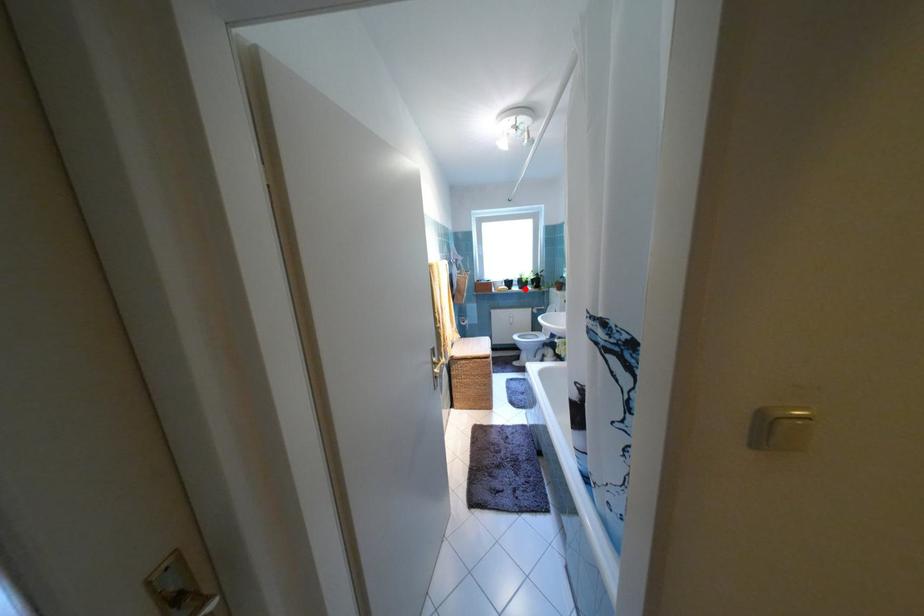
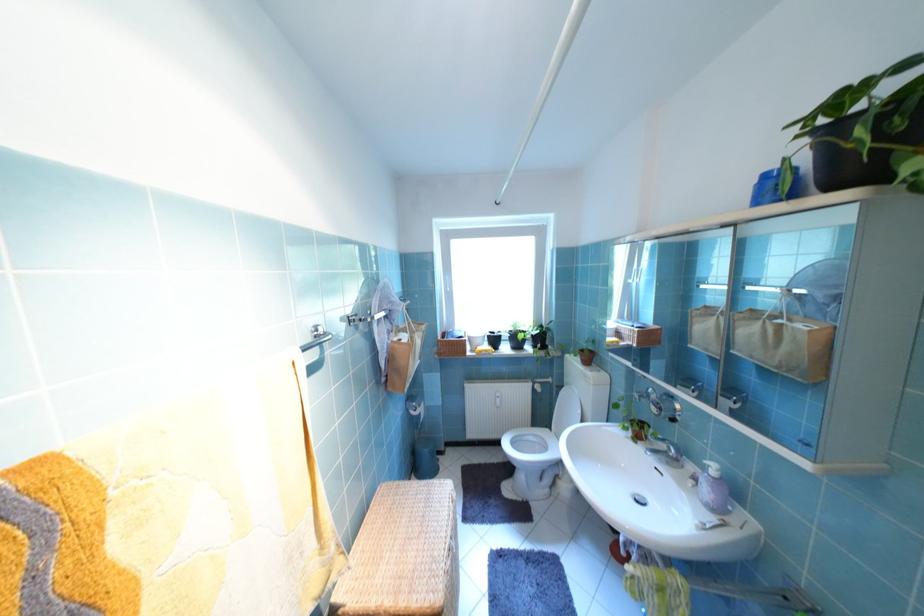
Find the pixel in the second image that matches the highlighted location in the first image.

(515, 349)